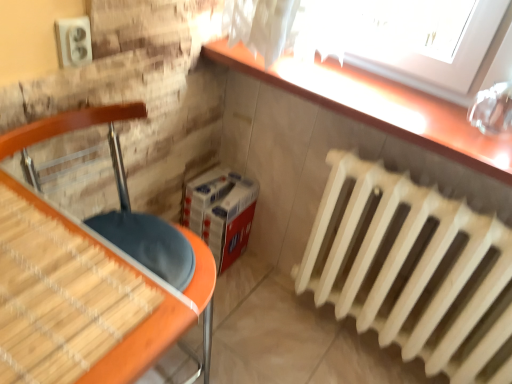
Identify the location of matte orange table at lower left. This screenshot has width=512, height=384. (x=83, y=297).

What is the approximate width of smooth wooden counter at upper right?

12.15 inches.

Image resolution: width=512 pixels, height=384 pixels. What are the coordinates of `white wooden radiator at lower right` in the screenshot? It's located at (413, 270).

Between white wooden radiator at lower right and smooth wooden counter at upper right, which one has more height?

With more height is white wooden radiator at lower right.

Based on their positions, is white wooden radiator at lower right located to the left or right of smooth wooden counter at upper right?

white wooden radiator at lower right is positioned on smooth wooden counter at upper right's right side.

From the image's perspective, is white wooden radiator at lower right located beneath smooth wooden counter at upper right?

Yes, from the image's perspective, white wooden radiator at lower right is beneath smooth wooden counter at upper right.

Considering the points (462, 318) and (375, 90), which point is behind, point (462, 318) or point (375, 90)?

Positioned behind is point (375, 90).

Which of these two, smooth wooden counter at upper right or matte orange table at lower left, is smaller?

Smaller between the two is smooth wooden counter at upper right.

Consider the image. Is matte orange table at lower left completely or partially inside smooth wooden counter at upper right?

Actually, matte orange table at lower left is outside smooth wooden counter at upper right.

In the image, is smooth wooden counter at upper right on the left side or the right side of matte orange table at lower left?

smooth wooden counter at upper right is positioned on matte orange table at lower left's right side.

From the image's perspective, is smooth wooden counter at upper right located beneath matte orange table at lower left?

Actually, smooth wooden counter at upper right appears above matte orange table at lower left in the image.

Can you confirm if matte orange table at lower left is smaller than smooth wooden counter at upper right?

No.

Based on the photo, is matte orange table at lower left taller or shorter than smooth wooden counter at upper right?

Considering their sizes, matte orange table at lower left has more height than smooth wooden counter at upper right.

Is matte orange table at lower left outside of smooth wooden counter at upper right?

That's correct, matte orange table at lower left is outside of smooth wooden counter at upper right.

Does matte orange table at lower left turn towards smooth wooden counter at upper right?

No, matte orange table at lower left is not turned towards smooth wooden counter at upper right.

Locate an element on the screen. This screenshot has height=384, width=512. furniture in front of the white wooden radiator at lower right is located at coordinates (83, 297).

From the image's perspective, is matte orange table at lower left positioned above or below white wooden radiator at lower right?

From the image's perspective, matte orange table at lower left appears above white wooden radiator at lower right.

From the image's perspective, which is below, white wooden radiator at lower right or matte orange table at lower left?

white wooden radiator at lower right, from the image's perspective.

Where is `radiator behind the matte orange table at lower left`? This screenshot has height=384, width=512. radiator behind the matte orange table at lower left is located at coordinates 413,270.

Is white wooden radiator at lower right completely or partially outside of matte orange table at lower left?

That's correct, white wooden radiator at lower right is outside of matte orange table at lower left.

Is white wooden radiator at lower right at the right side of matte orange table at lower left?

Indeed, white wooden radiator at lower right is positioned on the right side of matte orange table at lower left.

Is smooth wooden counter at upper right looking in the opposite direction of white wooden radiator at lower right?

No, white wooden radiator at lower right is not at the back of smooth wooden counter at upper right.

Is smooth wooden counter at upper right spatially inside white wooden radiator at lower right, or outside of it?

smooth wooden counter at upper right is outside white wooden radiator at lower right.

Is point (338, 98) farther from camera compared to point (490, 247)?

Yes, it is.

Considering the relative sizes of smooth wooden counter at upper right and white wooden radiator at lower right in the image provided, is smooth wooden counter at upper right bigger than white wooden radiator at lower right?

No, smooth wooden counter at upper right is not bigger than white wooden radiator at lower right.

The height and width of the screenshot is (384, 512). I want to click on radiator below the smooth wooden counter at upper right (from the image's perspective), so click(413, 270).

Identify the location of counter top behind the matte orange table at lower left. (378, 106).

When comparing their distances from smooth wooden counter at upper right, does white wooden radiator at lower right or matte orange table at lower left seem further?

matte orange table at lower left.

Considering their positions, is matte orange table at lower left positioned further to white wooden radiator at lower right than smooth wooden counter at upper right?

Among the two, matte orange table at lower left is located further to white wooden radiator at lower right.

Which object lies further to the anchor point white wooden radiator at lower right, smooth wooden counter at upper right or matte orange table at lower left?

matte orange table at lower left is positioned further to the anchor white wooden radiator at lower right.

Looking at the image, which one is located closer to matte orange table at lower left, white wooden radiator at lower right or smooth wooden counter at upper right?

Based on the image, smooth wooden counter at upper right appears to be nearer to matte orange table at lower left.

Estimate the real-world distances between objects in this image. Which object is further from smooth wooden counter at upper right, matte orange table at lower left or white wooden radiator at lower right?

matte orange table at lower left is further to smooth wooden counter at upper right.

Estimate the real-world distances between objects in this image. Which object is further from matte orange table at lower left, smooth wooden counter at upper right or white wooden radiator at lower right?

Based on the image, white wooden radiator at lower right appears to be further to matte orange table at lower left.

You are a GUI agent. You are given a task and a screenshot of the screen. Output one action in this format:
    pyautogui.click(x=<x>, y=<y>)
    Task: Click on the counter top between matte orange table at lower left and white wooden radiator at lower right
    Image resolution: width=512 pixels, height=384 pixels.
    Given the screenshot: What is the action you would take?
    pyautogui.click(x=378, y=106)